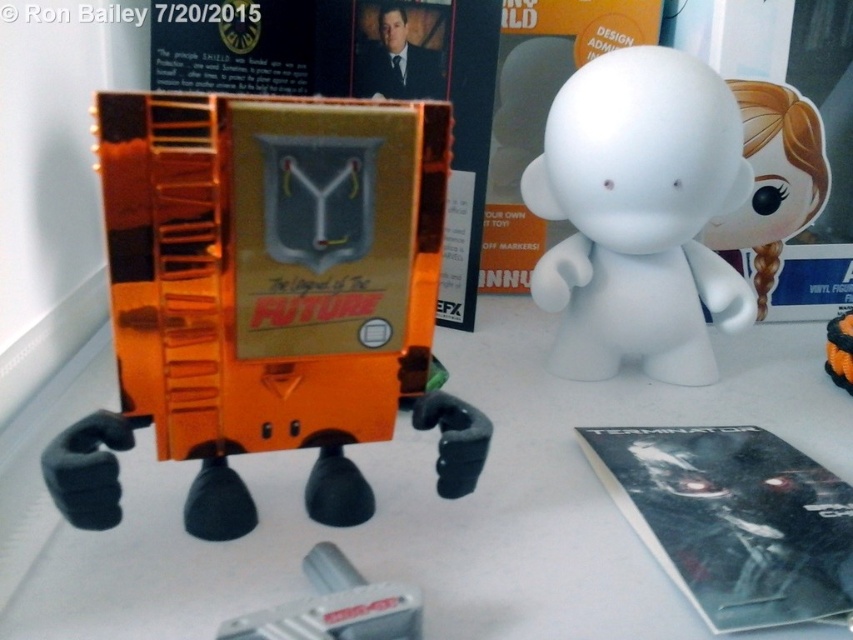
Question: Which point is farther to the camera?

Choices:
 (A) (683, 195)
 (B) (280, 163)

Answer: (A)

Question: Is translucent orange plastic toy at center above white matte figurine at center?

Choices:
 (A) yes
 (B) no

Answer: (B)

Question: Can you confirm if translucent orange plastic toy at center is wider than white matte figurine at center?

Choices:
 (A) yes
 (B) no

Answer: (A)

Question: Estimate the real-world distances between objects in this image. Which object is farther from the white matte figurine at center?

Choices:
 (A) translucent orange plastic toy at center
 (B) metallic gray tool at lower center

Answer: (B)

Question: Which point is closer to the camera?

Choices:
 (A) white matte figurine at center
 (B) metallic gray tool at lower center
 (C) translucent orange plastic toy at center

Answer: (B)

Question: From the image, what is the correct spatial relationship of white matte figurine at center in relation to metallic gray tool at lower center?

Choices:
 (A) right
 (B) left

Answer: (A)